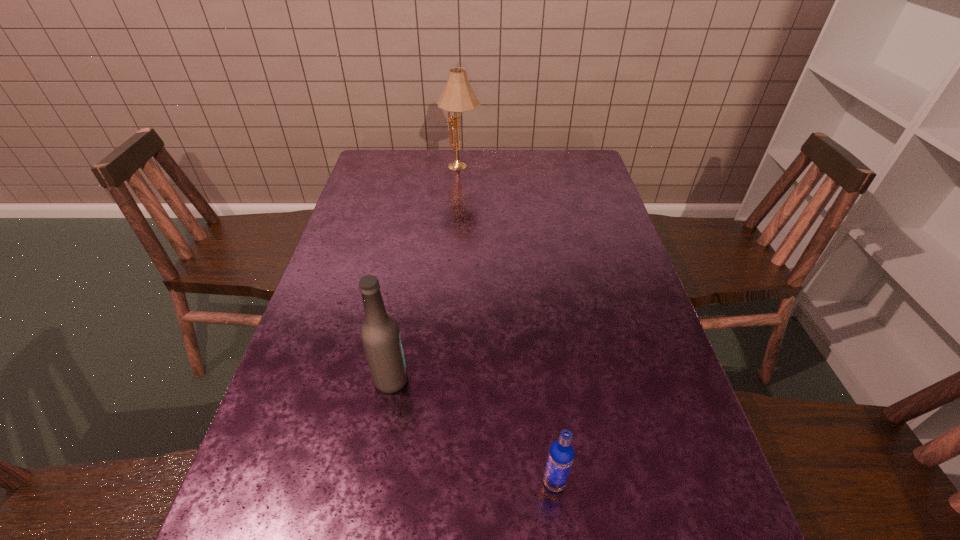
Locate an element on the screen. Image resolution: width=960 pixels, height=540 pixels. blank area at the far edge is located at coordinates (427, 154).

Locate an element on the screen. free spot at the left edge of the desktop is located at coordinates (272, 520).

Find the location of a particular element. The image size is (960, 540). free region at the right edge is located at coordinates (601, 193).

Identify the location of free region at the far left corner of the desktop. This screenshot has height=540, width=960. (372, 176).

At what (x,y) coordinates should I click in order to perform the action: click on vacant region at the far right corner of the desktop. Please return your answer as a coordinate pair (x, y). The image size is (960, 540). Looking at the image, I should click on (556, 168).

This screenshot has height=540, width=960. I want to click on empty space that is in between the rightmost object and the beer bottle, so click(472, 431).

Identify the location of blank region between the shortest object and the second object from right to left. click(x=508, y=325).

Identify the location of vacant space that is in between the farthest object and the second farthest object. This screenshot has height=540, width=960. (426, 273).

This screenshot has height=540, width=960. Identify the location of vacant area that lies between the vodka and the second object from left to right. (508, 325).

I want to click on free space that is in between the tallest object and the second nearest object, so click(x=426, y=273).